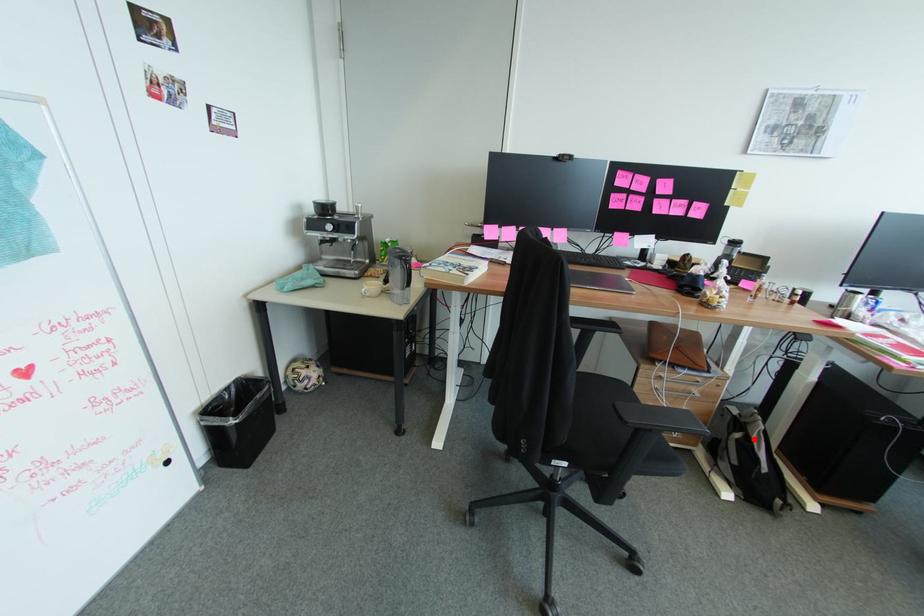
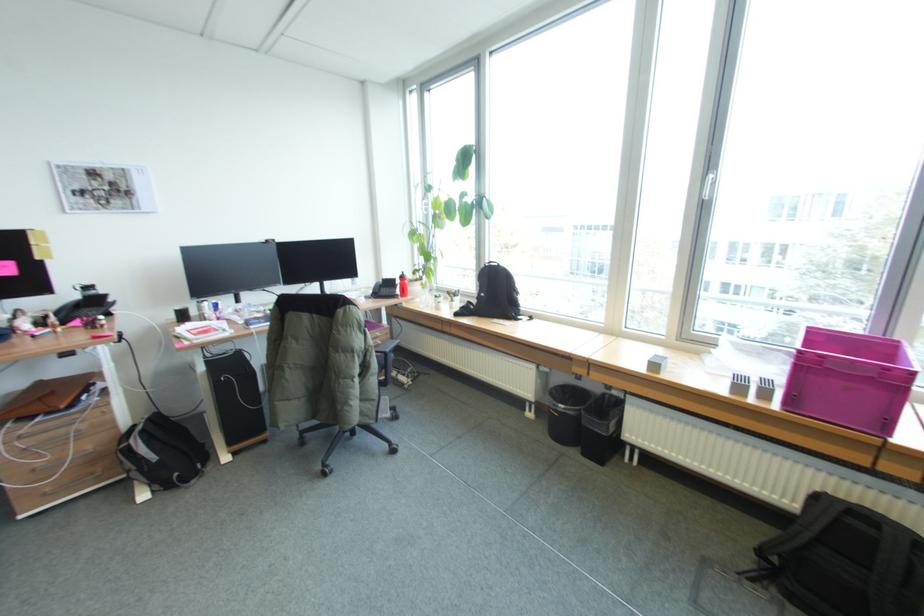
Question: I am providing you with two images of the same scene from different viewpoints. Given a red point in image1, look at the same physical point in image2. Is it:

Choices:
 (A) Closer to the viewpoint
 (B) Farther from the viewpoint

Answer: (A)